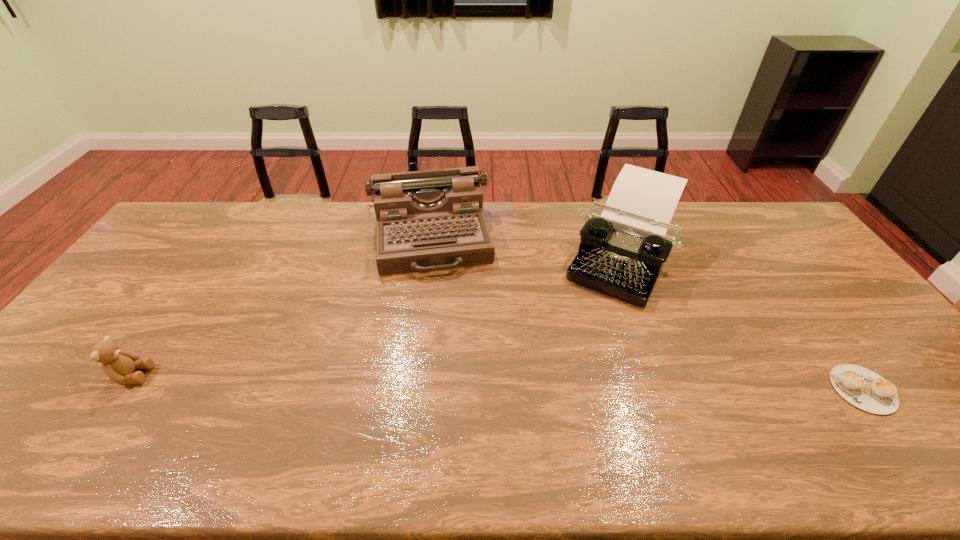
You are a GUI agent. You are given a task and a screenshot of the screen. Output one action in this format:
    pyautogui.click(x=<x>, y=<y>)
    Task: Click on the free space on the desktop that is between the teddy bear and the rightmost object and is positioned on the keys of the second object from right to left
    
    Given the screenshot: What is the action you would take?
    pyautogui.click(x=552, y=383)

Identify the location of free space on the desktop that is between the second shortest object and the shortest object and is positioned on the keyboard of the left typewriter. This screenshot has height=540, width=960. (449, 381).